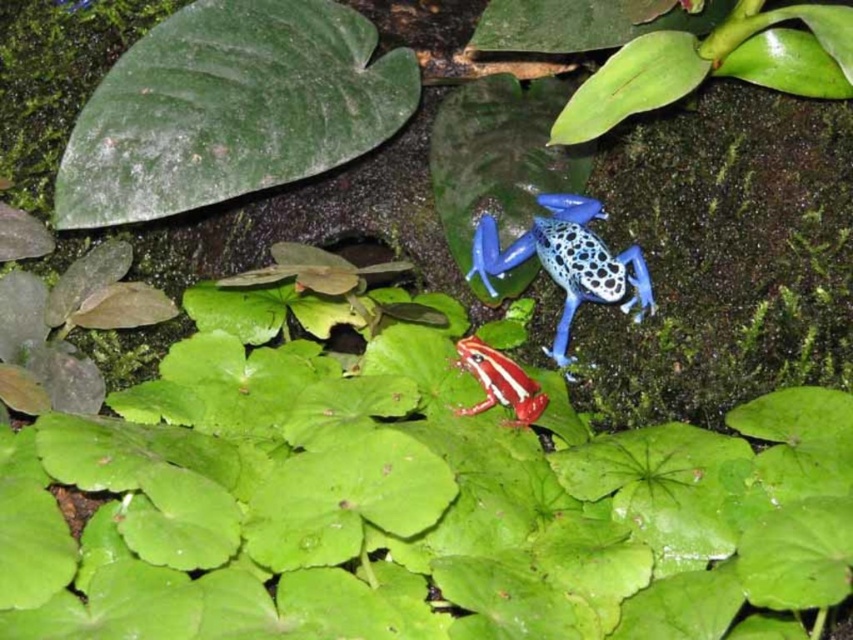
Which is above, blue glossy spotted frog at center or smooth red and white frog at center?

Positioned higher is blue glossy spotted frog at center.

Does blue glossy spotted frog at center have a lesser width compared to smooth red and white frog at center?

No, blue glossy spotted frog at center is not thinner than smooth red and white frog at center.

Which is behind, point (544, 198) or point (486, 364)?

Positioned behind is point (544, 198).

This screenshot has width=853, height=640. I want to click on blue glossy spotted frog at center, so click(x=566, y=260).